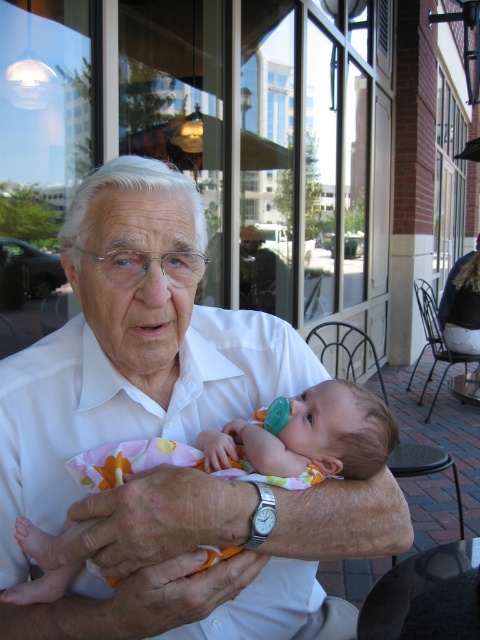
Looking at this image, who is more distant from viewer, (290,636) or (204,458)?

Positioned behind is point (290,636).

Where is `white smooth shirt at center`? The image size is (480, 640). white smooth shirt at center is located at coordinates (167, 436).

Image resolution: width=480 pixels, height=640 pixels. I want to click on white smooth shirt at center, so click(167, 436).